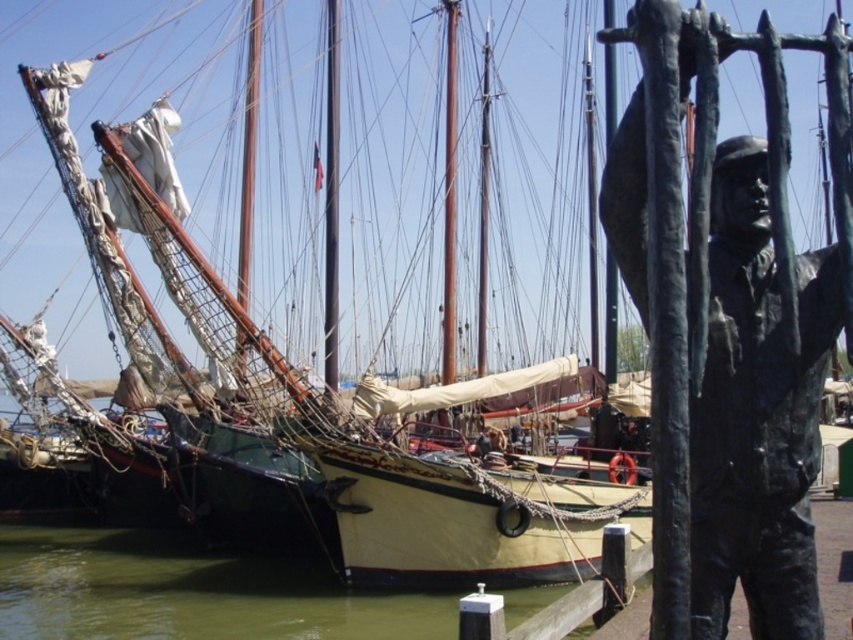
You are a photographer trying to capture the bronze statue at right and the green water at lower left in the same frame. Which object will appear narrower in your photo?

The bronze statue at right is thinner than the green water at lower left, so it will appear narrower in the photo.

You are standing at the origin point of the harbor scene. There is a bronze statue at right represented by point (727, 333). Can you determine if the bronze statue at right is located to the left or right of the origin point?

The bronze statue at right is located at point (727, 333). Since the x coordinate is 0.523, which is greater than 0.5, the bronze statue at right is to the right of the origin point.

You are a photographer standing in the harbor scene. You want to capture both the bronze statue at right and the green water at lower left in a single shot. Since you can only focus on one subject, which one should you choose to ensure it appears larger in the photo?

You should focus on the bronze statue at right because it has a greater height compared to the green water at lower left, making it naturally larger in the photo.